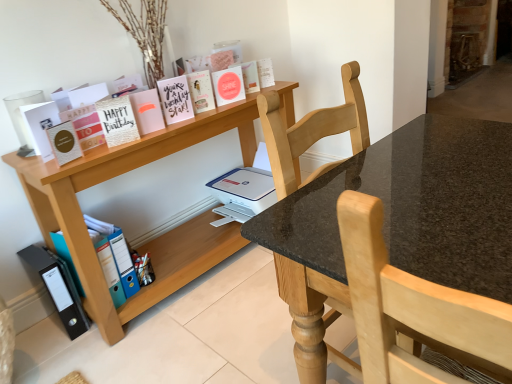
Question: Would you say hardcover book at upper center, the 10th paperback book in the left-to-right sequence, is to the left or to the right of gold textured card at upper left, marked as the 4th paperback book in a left-to-right arrangement, in the picture?

Choices:
 (A) left
 (B) right

Answer: (B)

Question: From their relative heights in the image, would you say hardcover book at upper center, which appears as the 1th paperback book when viewed from the right, is taller or shorter than gold textured card at upper left, marked as the 4th paperback book in a left-to-right arrangement?

Choices:
 (A) tall
 (B) short

Answer: (B)

Question: Which is farther from the gold textured card at upper left, which is the seventh paperback book in right-to-left order?

Choices:
 (A) blue plastic folder at lower left, which appears as the 3th paperback book when viewed from the left
 (B) black granite table at center
 (C) matte white card at left, the tenth paperback book when ordered from right to left
 (D) hardcover book at upper center, which appears as the 1th paperback book when viewed from the right
 (E) wooden shelf at upper left

Answer: (B)

Question: Which object is positioned closest to the black granite table at center?

Choices:
 (A) matte pink paper at upper center, which is the 9th paperback book in left-to-right order
 (B) blue plastic file at lower left, which appears as the second book when viewed from the top
 (C) black plastic bin at lower left
 (D) matte pink card at upper center, placed as the seventh paperback book when sorted from left to right
 (E) pink matte card at upper center, which appears as the 5th paperback book when viewed from the left

Answer: (E)